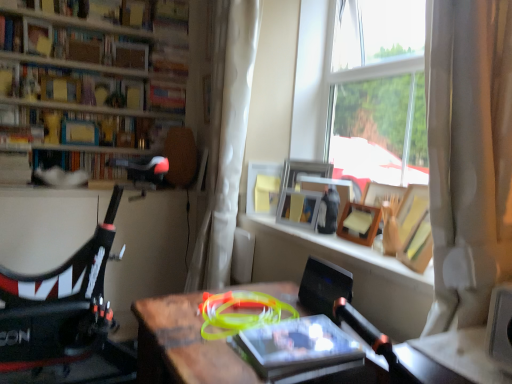
Question: Looking at their shapes, would you say wooden picture frame at upper right, placed as the 2th picture frame when sorted from left to right, is wider or thinner than wooden picture frame at window, which appears as the third picture frame when viewed from the left?

Choices:
 (A) thin
 (B) wide

Answer: (A)

Question: From the image's perspective, is wooden picture frame at upper right, which is counted as the third picture frame, starting from the right, located above or below wooden picture frame at window, which is counted as the second picture frame, starting from the right?

Choices:
 (A) below
 (B) above

Answer: (B)

Question: Based on their relative distances, which object is farther from the wooden picture frame at upper right, placed as the 2th picture frame when sorted from left to right?

Choices:
 (A) matte black bookshelf at center, placed as the second book when sorted from bottom to top
 (B) wooden frame at upper center
 (C) matte white picture frame at center, which is the 1th picture frame in left-to-right order
 (D) wooden desk at center
 (E) matte yellow book at upper left, acting as the third book starting from the front

Answer: (E)

Question: Which object is positioned farthest from the hardcover book at upper center, marked as the 2th book in a top-to-bottom arrangement?

Choices:
 (A) wooden picture frame at upper right, which is counted as the third picture frame, starting from the right
 (B) matte yellow book at upper left, the 1th book when ordered from top to bottom
 (C) wooden desk at center
 (D) matte black bookshelf at center, the 4th book in the top-to-bottom sequence
 (E) matte yellow book at upper left, arranged as the third book when viewed from the back

Answer: (C)